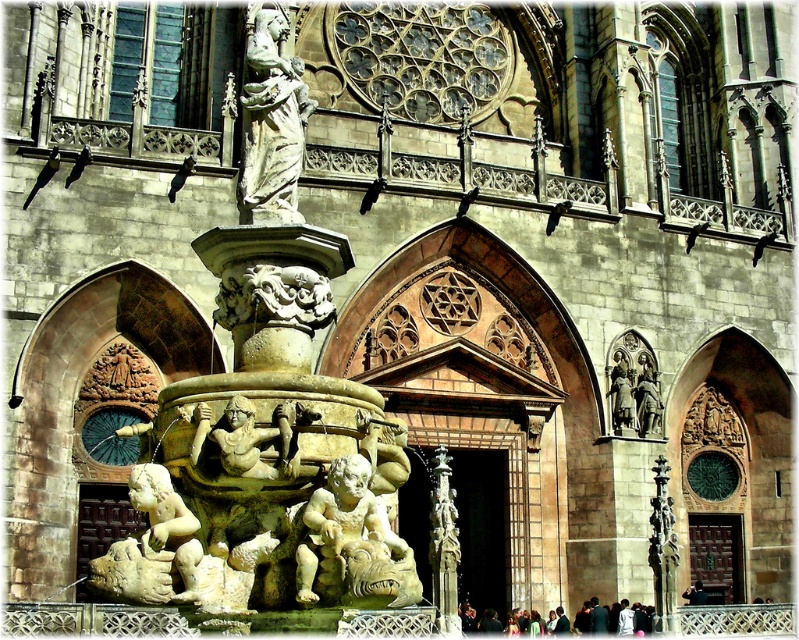
Can you confirm if white stone fountain at center is positioned above polished bronze statue at right?

Yes.

Is point (110, 595) farther from camera compared to point (635, 388)?

That is False.

Locate an element on the screen. white stone fountain at center is located at coordinates (272, 420).

Can you confirm if polished bronze statue at center is shorter than polished bronze statue at right?

In fact, polished bronze statue at center may be taller than polished bronze statue at right.

Is polished bronze statue at center bigger than polished bronze statue at right?

Correct, polished bronze statue at center is larger in size than polished bronze statue at right.

This screenshot has height=640, width=799. I want to click on polished bronze statue at center, so click(622, 396).

At what (x,y) coordinates should I click in order to perform the action: click on polished bronze statue at center. Please return your answer as a coordinate pair (x, y). This screenshot has height=640, width=799. Looking at the image, I should click on (622, 396).

Does carved stone gargoyle at center lie in front of white marble cherub at lower left?

Yes, carved stone gargoyle at center is closer to the viewer.

Is carved stone gargoyle at center above white marble cherub at lower left?

Yes.

Where is `carved stone gargoyle at center`? The height and width of the screenshot is (640, 799). carved stone gargoyle at center is located at coordinates (352, 544).

Where is `carved stone gargoyle at center`? The height and width of the screenshot is (640, 799). carved stone gargoyle at center is located at coordinates (352, 544).